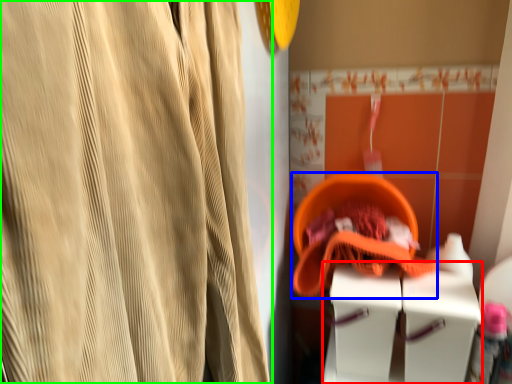
Question: Based on their relative distances, which object is farther from vanity (highlighted by a red box)? Choose from basket (highlighted by a blue box) and curtain (highlighted by a green box).

Choices:
 (A) basket
 (B) curtain

Answer: (B)